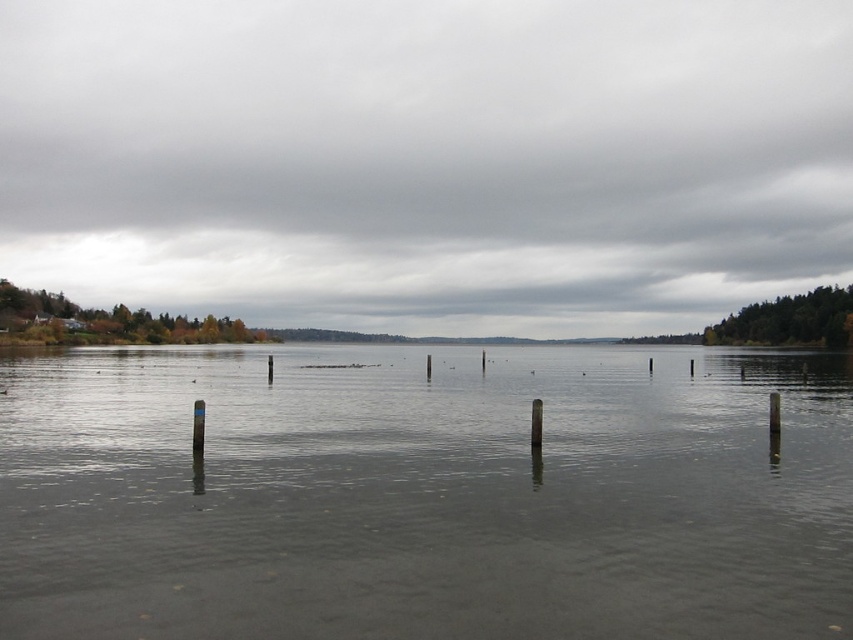
Question: Does gray cloudy sky at upper center have a lesser width compared to black wood pole at center-right?

Choices:
 (A) no
 (B) yes

Answer: (A)

Question: Which point is farther to the camera?

Choices:
 (A) (532, 435)
 (B) (202, 410)

Answer: (A)

Question: Among these objects, which one is nearest to the camera?

Choices:
 (A) smooth wood post at center
 (B) black plastic pole at lower left
 (C) gray matte water at center

Answer: (C)

Question: Can you confirm if smooth wood post at center is positioned to the right of black wood pole at center-right?

Choices:
 (A) yes
 (B) no

Answer: (B)

Question: Is gray matte water at center further to the viewer compared to black plastic pole at lower left?

Choices:
 (A) yes
 (B) no

Answer: (B)

Question: Considering the real-world distances, which object is closest to the black wood pole at center-right?

Choices:
 (A) gray cloudy sky at upper center
 (B) gray matte water at center
 (C) smooth wood post at center

Answer: (C)